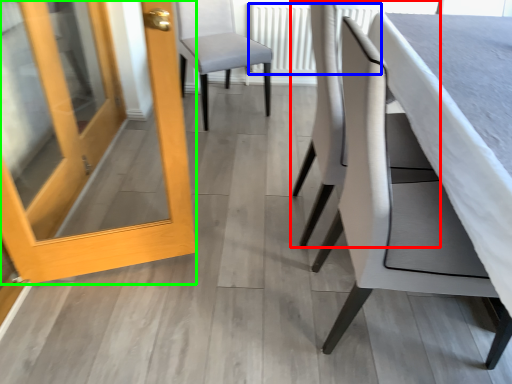
Question: Which is farther away from chair (highlighted by a red box)? radiator (highlighted by a blue box) or door (highlighted by a green box)?

Choices:
 (A) radiator
 (B) door

Answer: (A)